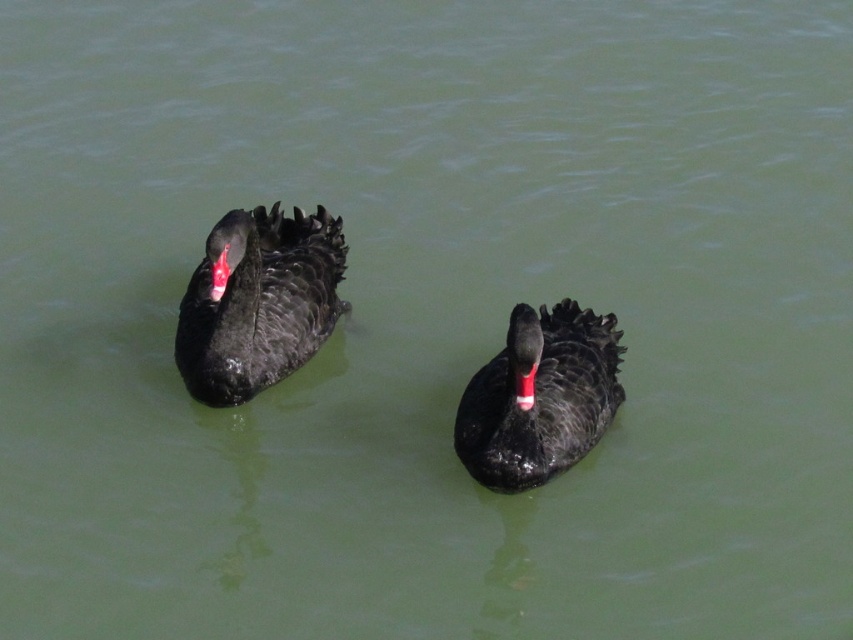
Question: Does matte black swan at left appear under matte black duck at center?

Choices:
 (A) no
 (B) yes

Answer: (A)

Question: Is matte black swan at left bigger than matte black duck at center?

Choices:
 (A) yes
 (B) no

Answer: (A)

Question: Does matte black swan at left appear on the right side of matte black duck at center?

Choices:
 (A) yes
 (B) no

Answer: (B)

Question: Which point is farther to the camera?

Choices:
 (A) matte black swan at left
 (B) matte black duck at center

Answer: (A)

Question: Which of the following is the farthest from the observer?

Choices:
 (A) (270, 282)
 (B) (537, 394)

Answer: (A)

Question: Which of the following is the farthest from the observer?

Choices:
 (A) matte black duck at center
 (B) matte black swan at left

Answer: (B)